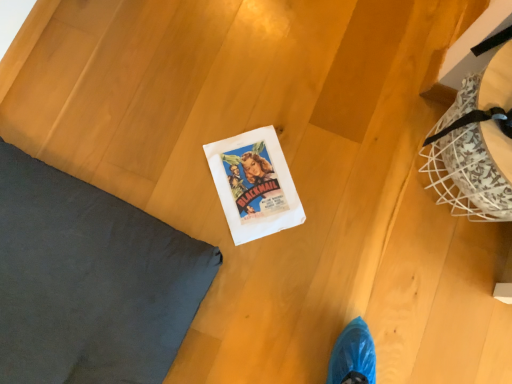
Locate an element on the screen. free point below white paper comic book at center (from a real-world perspective) is located at coordinates (240, 157).